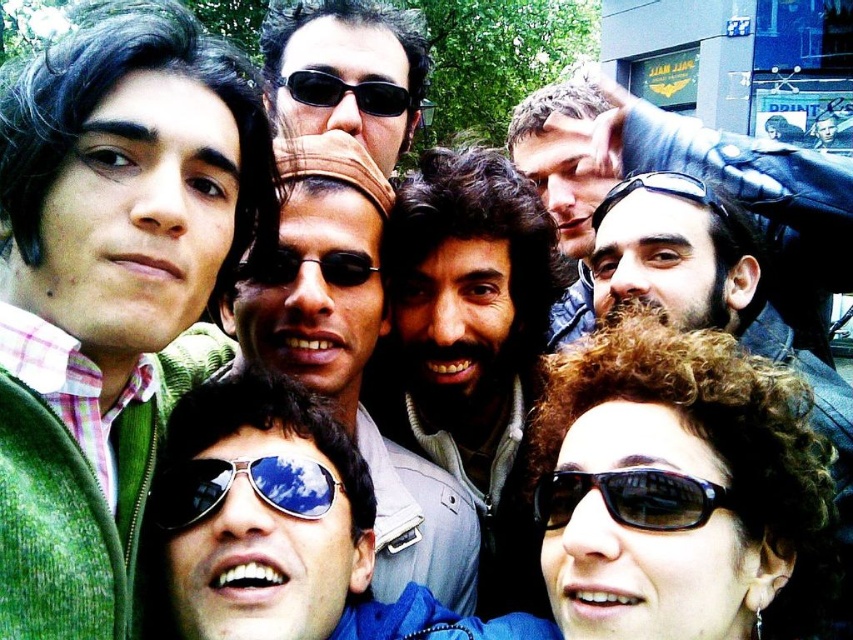
You are a photographer standing 10 meters away from the group in the image. You want to take a closeup shot of the matte brown jacket at center. Is the current distance sufficient for you to capture the jacket clearly without moving closer?

The matte brown jacket at center is 5.63 meters away from the camera. Since you are currently 10 meters away, you need to move closer to 5.63 meters to capture it clearly.